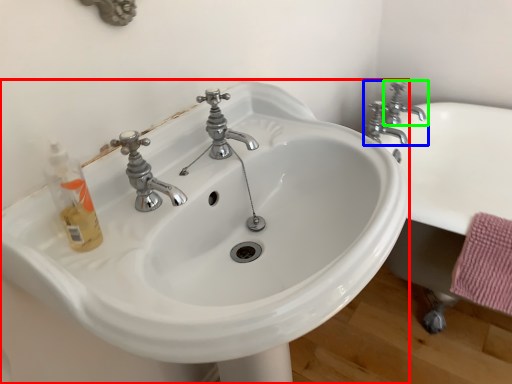
Question: Considering the real-world distances, which object is closest to sink (highlighted by a red box)? tap (highlighted by a blue box) or tap (highlighted by a green box).

Choices:
 (A) tap
 (B) tap

Answer: (A)